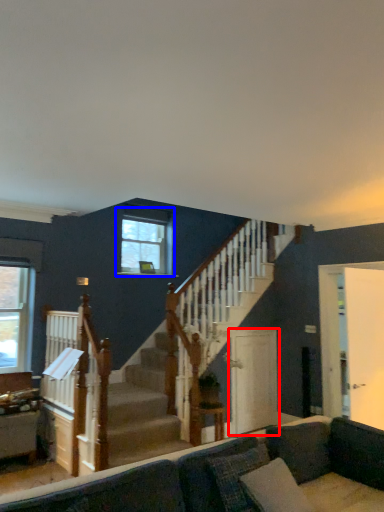
Question: Which object is closer to the camera taking this photo, screen door (highlighted by a red box) or window (highlighted by a blue box)?

Choices:
 (A) screen door
 (B) window

Answer: (A)